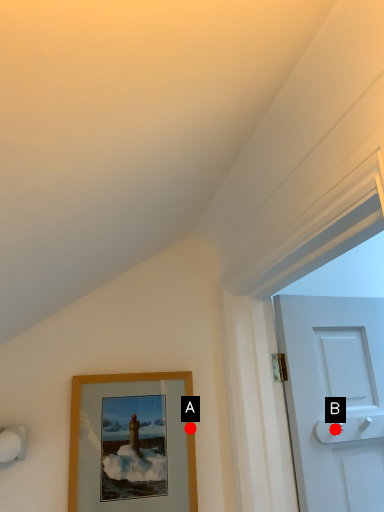
Question: Two points are circled on the image, labeled by A and B beside each circle. Which point is closer to the camera?

Choices:
 (A) A is closer
 (B) B is closer

Answer: (B)